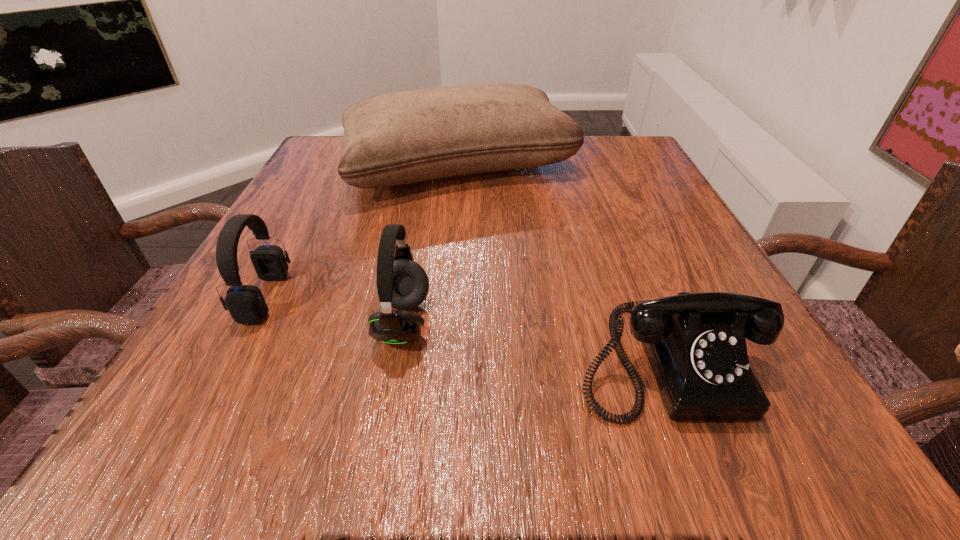
You are a GUI agent. You are given a task and a screenshot of the screen. Output one action in this format:
    pyautogui.click(x=<x>, y=<y>)
    Task: Click on the object present at the right edge
    
    Given the screenshot: What is the action you would take?
    pyautogui.click(x=696, y=345)

Where is `object situated at the far left corner`? The width and height of the screenshot is (960, 540). object situated at the far left corner is located at coordinates (412, 136).

Locate an element on the screen. object located at the near right corner is located at coordinates pos(696,345).

Locate an element on the screen. The height and width of the screenshot is (540, 960). vacant region at the far edge of the desktop is located at coordinates (552, 180).

In order to click on free point at the left edge in this screenshot , I will do `click(312, 330)`.

Locate an element on the screen. vacant space at the right edge of the desktop is located at coordinates (658, 221).

Find the location of `vacant space at the far left corner`. vacant space at the far left corner is located at coordinates (324, 154).

The image size is (960, 540). I want to click on vacant space at the near left corner, so click(156, 428).

In the image, there is a desktop. Where is `vacant space at the far right corner`? vacant space at the far right corner is located at coordinates (652, 173).

I want to click on empty space between the telephone and the right headset, so click(x=534, y=340).